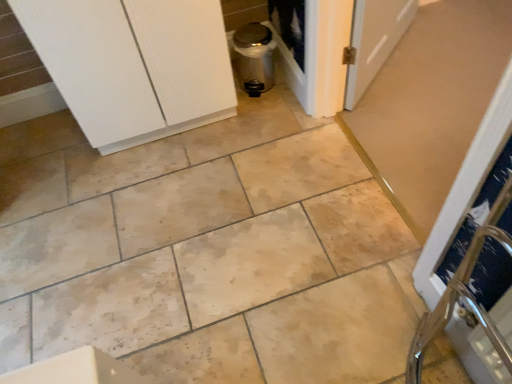
Question: From a real-world perspective, does white textured cabinet at upper left stand above metallic silver screen door at center?

Choices:
 (A) no
 (B) yes

Answer: (B)

Question: From a real-world perspective, is white textured cabinet at upper left under metallic silver screen door at center?

Choices:
 (A) yes
 (B) no

Answer: (B)

Question: Does white textured cabinet at upper left have a greater width compared to metallic silver screen door at center?

Choices:
 (A) no
 (B) yes

Answer: (B)

Question: Is metallic silver screen door at center located within white textured cabinet at upper left?

Choices:
 (A) yes
 (B) no

Answer: (B)

Question: Does white textured cabinet at upper left appear on the right side of metallic silver screen door at center?

Choices:
 (A) no
 (B) yes

Answer: (A)

Question: Would you say metallic silver screen door at center is to the left or to the right of white textured cabinet at upper left in the picture?

Choices:
 (A) right
 (B) left

Answer: (A)

Question: From their relative heights in the image, would you say metallic silver screen door at center is taller or shorter than white textured cabinet at upper left?

Choices:
 (A) tall
 (B) short

Answer: (B)

Question: From a real-world perspective, is metallic silver screen door at center above or below white textured cabinet at upper left?

Choices:
 (A) above
 (B) below

Answer: (B)

Question: From the image's perspective, is metallic silver screen door at center above or below white textured cabinet at upper left?

Choices:
 (A) above
 (B) below

Answer: (B)

Question: From the image's perspective, relative to satin silver trash can at center, is white textured cabinet at upper left above or below?

Choices:
 (A) above
 (B) below

Answer: (B)

Question: Considering the positions of white textured cabinet at upper left and satin silver trash can at center in the image, is white textured cabinet at upper left bigger or smaller than satin silver trash can at center?

Choices:
 (A) small
 (B) big

Answer: (B)

Question: From a real-world perspective, is white textured cabinet at upper left positioned above or below satin silver trash can at center?

Choices:
 (A) above
 (B) below

Answer: (A)

Question: Is point (123, 129) closer or farther from the camera than point (243, 39)?

Choices:
 (A) farther
 (B) closer

Answer: (B)

Question: From the image's perspective, is satin silver trash can at center positioned above or below metallic silver screen door at center?

Choices:
 (A) below
 (B) above

Answer: (B)

Question: Is satin silver trash can at center inside or outside of metallic silver screen door at center?

Choices:
 (A) outside
 (B) inside

Answer: (A)